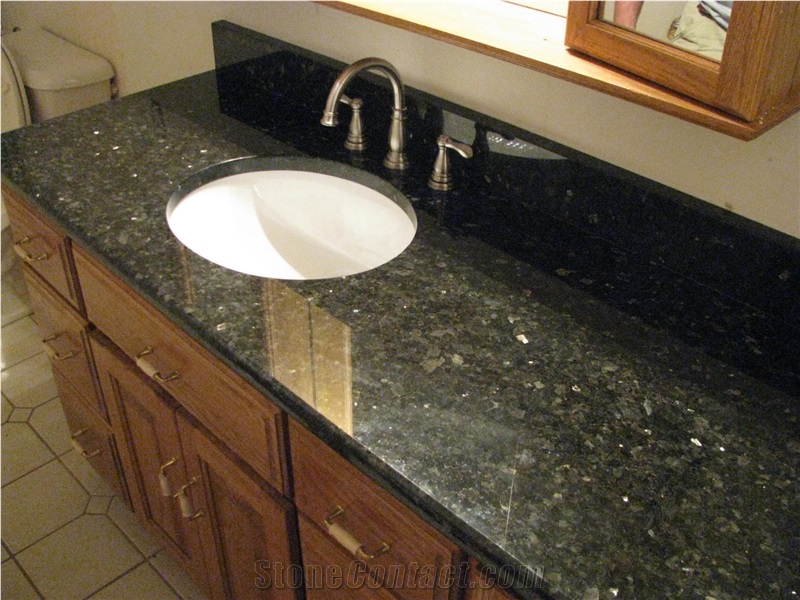
Identify the location of handle. (446, 182).